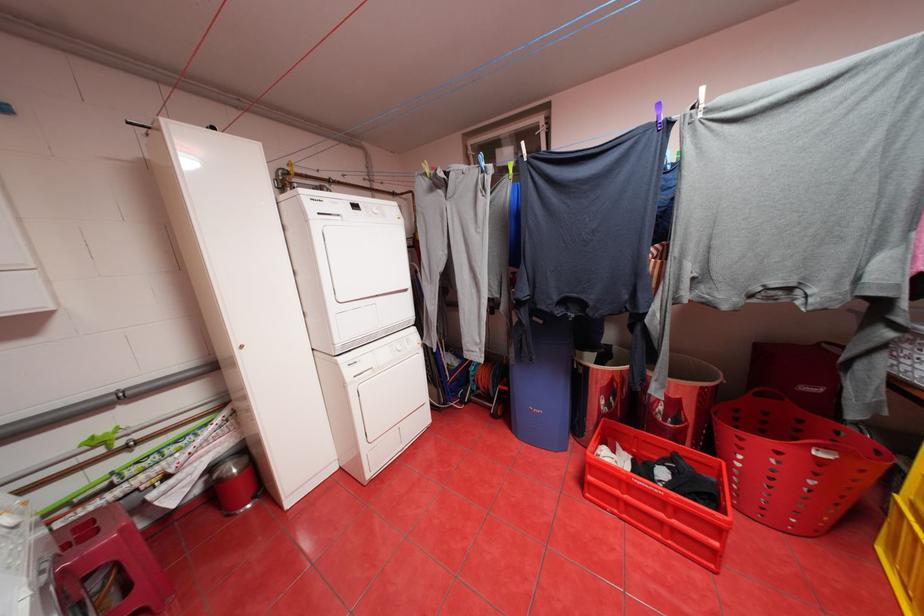
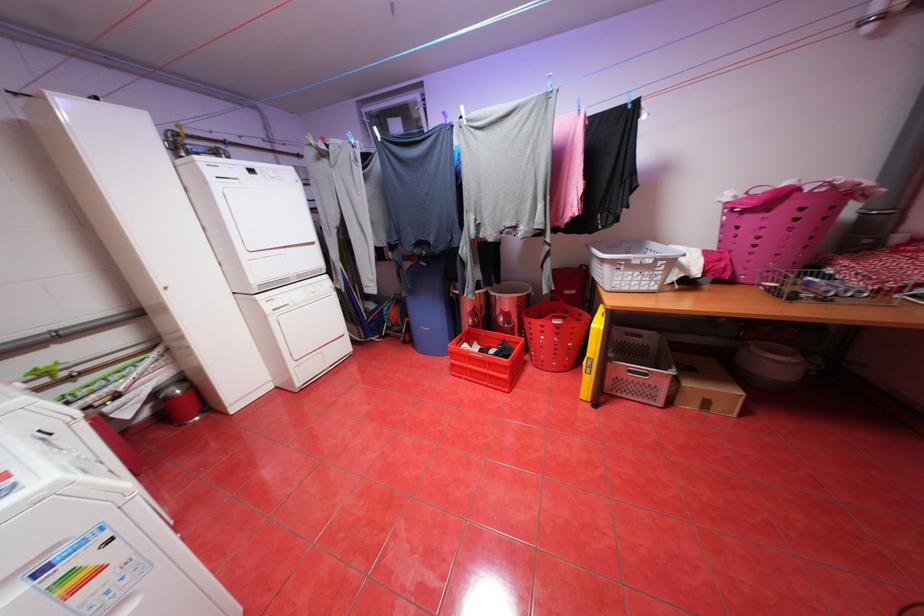
Locate, in the second image, the point that corresponds to (550,321) in the first image.

(433, 264)